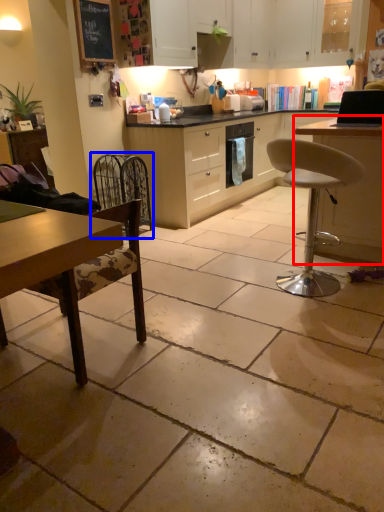
Question: Among these objects, which one is farthest to the camera, table (highlighted by a red box) or swivel chair (highlighted by a blue box)?

Choices:
 (A) table
 (B) swivel chair

Answer: (B)